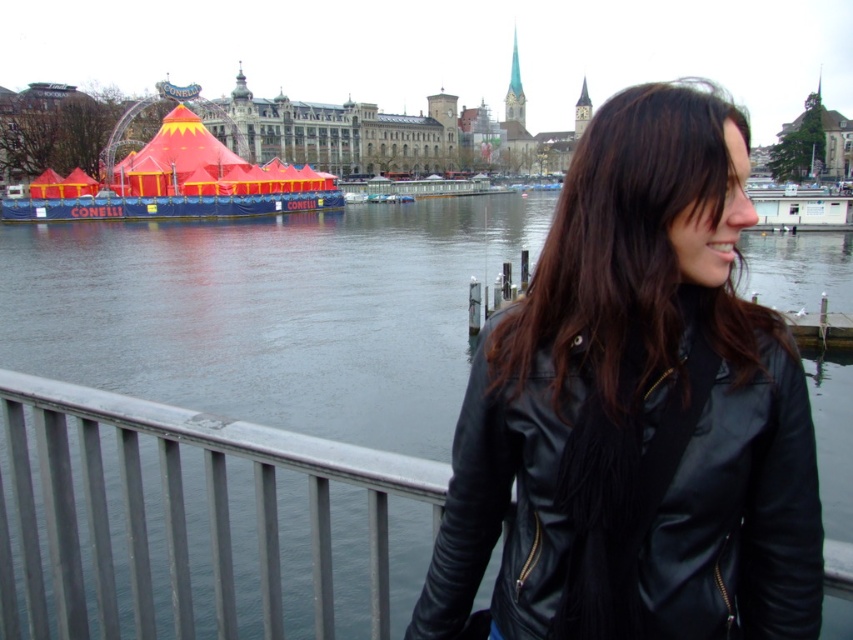
Question: Can you confirm if dark blue water at center is positioned above black leather jacket at right?

Choices:
 (A) yes
 (B) no

Answer: (A)

Question: In this image, where is black leather jacket at center located relative to dark blue water at center?

Choices:
 (A) above
 (B) below

Answer: (B)

Question: Based on their relative distances, which object is nearer to the black leather jacket at right?

Choices:
 (A) dark blue water at center
 (B) black leather jacket at center

Answer: (B)

Question: Which point appears closest to the camera in this image?

Choices:
 (A) (722, 512)
 (B) (187, 310)
 (C) (529, 116)
 (D) (610, 198)

Answer: (A)

Question: Can you confirm if black leather jacket at center is smaller than dark blue water at center?

Choices:
 (A) yes
 (B) no

Answer: (A)

Question: Which object is closer to the camera taking this photo?

Choices:
 (A) black leather jacket at right
 (B) black leather jacket at center

Answer: (B)